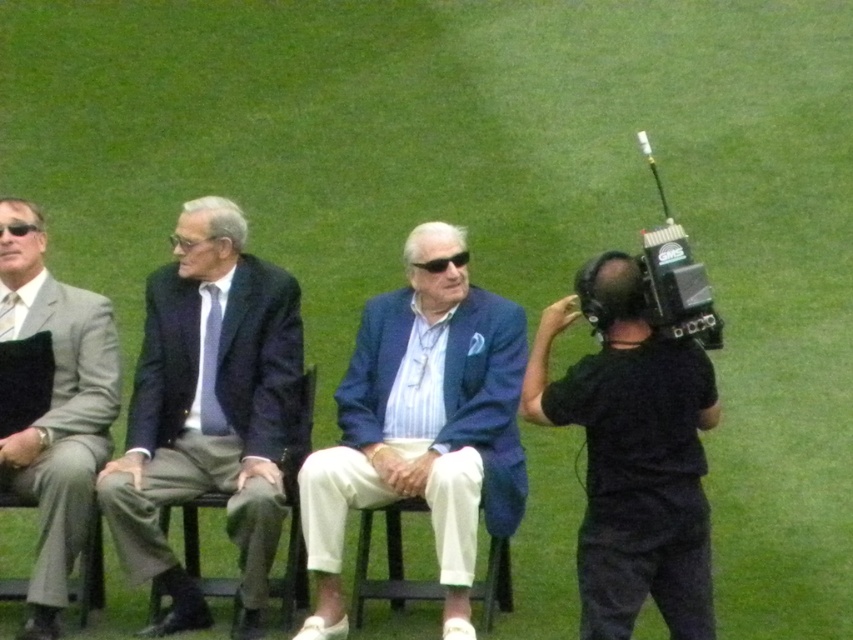
Consider the image. You are a photographer at the stadium and need to capture a clear photo of both the matte black suit at center and the black plastic video camera at right. Considering their heights, which object will appear larger in the photo?

The matte black suit at center will appear larger in the photo because it is much taller than the black plastic video camera at right.

You are standing at the entrance of the stadium and see three people sitting on a bench. The first person is wearing a light gray suit with a white shirt on the left, the second is in a dark navy suit with a light blue tie in the middle, and the third is wearing a matte black suit at center. Which person is sitting exactly in the center of the bench?

The matte black suit at center is located at point (207,410), which indicates it is positioned at the center of the bench.

You are a photographer standing 10 feet away from the matte black suit at center. You want to take a photo of the black plastic video camera at right without moving your position. Is the camera within your 15 feet shooting range?

The matte black suit at center and black plastic video camera at right are 11.56 feet apart from each other. Since you are 10 feet away from the matte black suit at center, the distance to the camera would be 10 feet plus 11.56 feet, totaling 21.56 feet. This exceeds your 15 feet shooting range, so the camera is out of range.